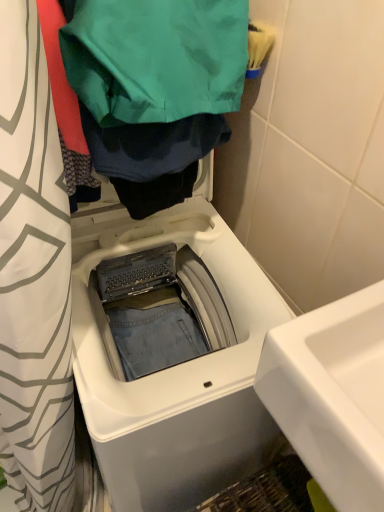
Question: Would you say green fabric bag at upper center is a long distance from white glossy sink at lower right?

Choices:
 (A) no
 (B) yes

Answer: (A)

Question: From a real-world perspective, is green fabric bag at upper center over white glossy sink at lower right?

Choices:
 (A) yes
 (B) no

Answer: (A)

Question: From the image's perspective, is green fabric bag at upper center below white glossy sink at lower right?

Choices:
 (A) no
 (B) yes

Answer: (A)

Question: From a real-world perspective, is green fabric bag at upper center beneath white glossy sink at lower right?

Choices:
 (A) yes
 (B) no

Answer: (B)

Question: Does green fabric bag at upper center lie in front of white glossy sink at lower right?

Choices:
 (A) yes
 (B) no

Answer: (B)

Question: Could white glossy sink at lower right be considered to be inside green fabric bag at upper center?

Choices:
 (A) no
 (B) yes

Answer: (A)

Question: Does white glossy sink at lower right have a smaller size compared to white plastic washing machine at center?

Choices:
 (A) no
 (B) yes

Answer: (B)

Question: From the image's perspective, is white glossy sink at lower right on white plastic washing machine at center?

Choices:
 (A) yes
 (B) no

Answer: (A)

Question: Is white glossy sink at lower right further to the viewer compared to white plastic washing machine at center?

Choices:
 (A) no
 (B) yes

Answer: (A)

Question: From a real-world perspective, is white glossy sink at lower right below white plastic washing machine at center?

Choices:
 (A) yes
 (B) no

Answer: (B)

Question: Could you tell me if white glossy sink at lower right is facing white plastic washing machine at center?

Choices:
 (A) no
 (B) yes

Answer: (A)

Question: Is white plastic washing machine at center located within white glossy sink at lower right?

Choices:
 (A) no
 (B) yes

Answer: (A)

Question: Would you say white plastic washing machine at center is part of green fabric bag at upper center's contents?

Choices:
 (A) no
 (B) yes

Answer: (A)